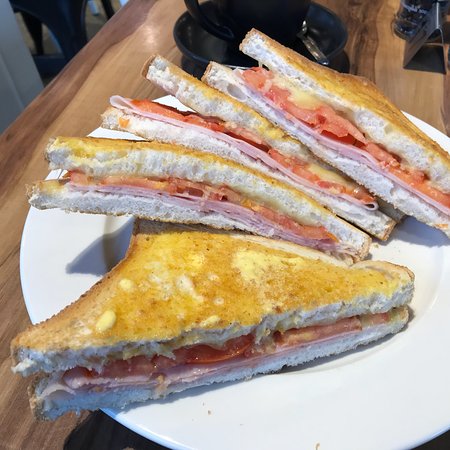
Locate an element on the screen. shadow under plate is located at coordinates (437, 441), (120, 436).